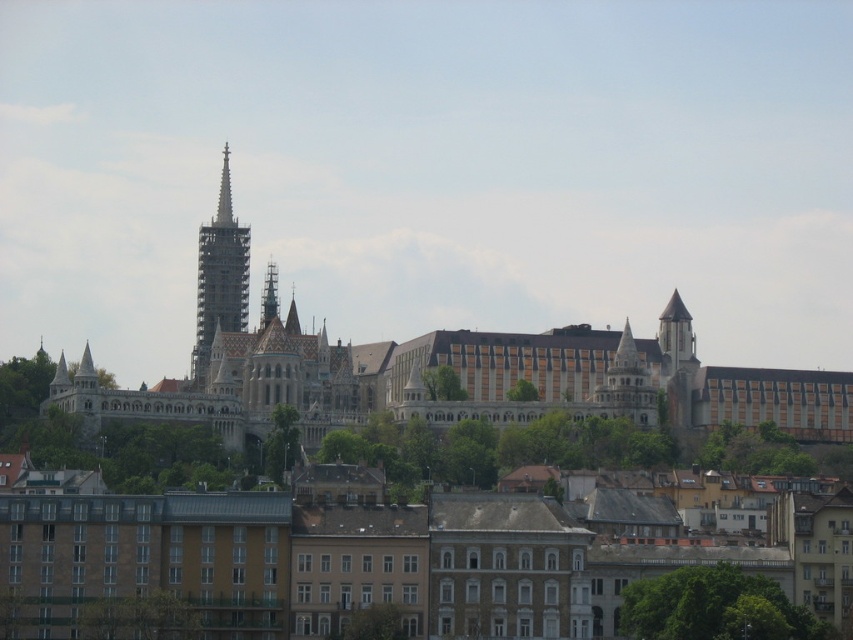
Question: Which of the following is the closest to the observer?

Choices:
 (A) (759, 381)
 (B) (271, 269)
 (C) (225, 269)

Answer: (A)

Question: Does white stone castle at center have a smaller size compared to smooth stone spire at center?

Choices:
 (A) yes
 (B) no

Answer: (B)

Question: Which point is closer to the camera taking this photo?

Choices:
 (A) (277, 314)
 (B) (546, 388)
 (C) (207, 240)

Answer: (B)

Question: Does white stone castle at center appear under smooth stone spire at center?

Choices:
 (A) yes
 (B) no

Answer: (A)

Question: Can you confirm if white stone castle at center is thinner than white stone spire at center?

Choices:
 (A) yes
 (B) no

Answer: (B)

Question: Which point is farther from the camera taking this photo?

Choices:
 (A) [91, 404]
 (B) [273, 273]
 (C) [202, 378]

Answer: (B)